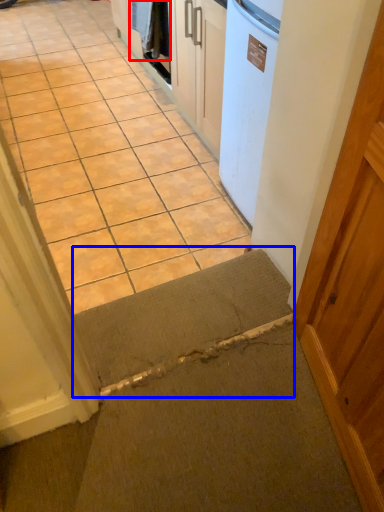
Question: Which of the following is the closest to the observer, laundry (highlighted by a red box) or doormat (highlighted by a blue box)?

Choices:
 (A) laundry
 (B) doormat

Answer: (B)